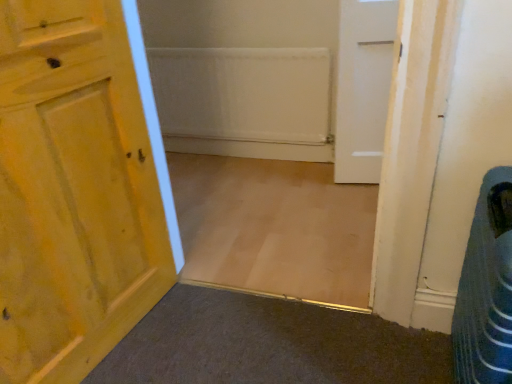
The height and width of the screenshot is (384, 512). Identify the location of vacant space in wooden door at left, the 2th door in the back-to-front sequence (from a real-world perspective). (130, 336).